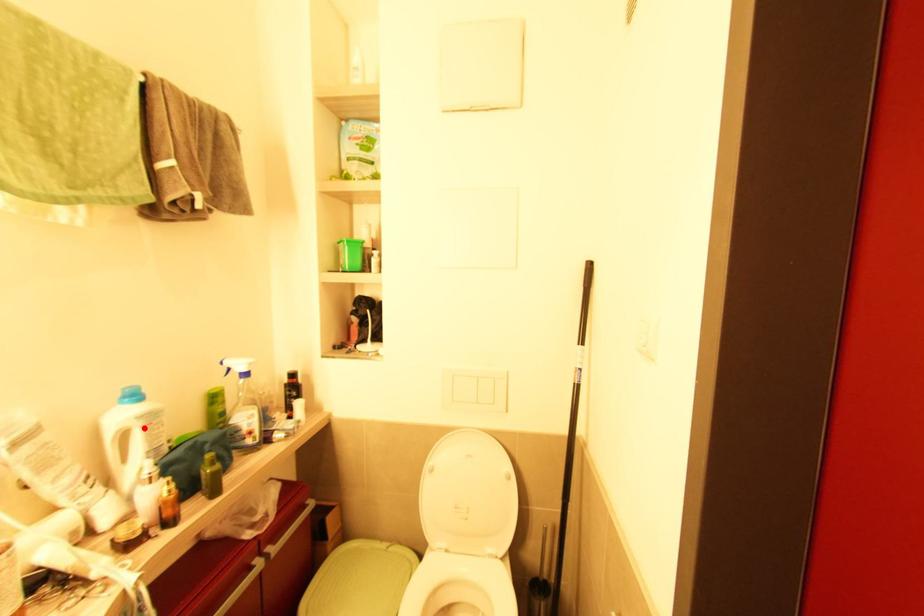
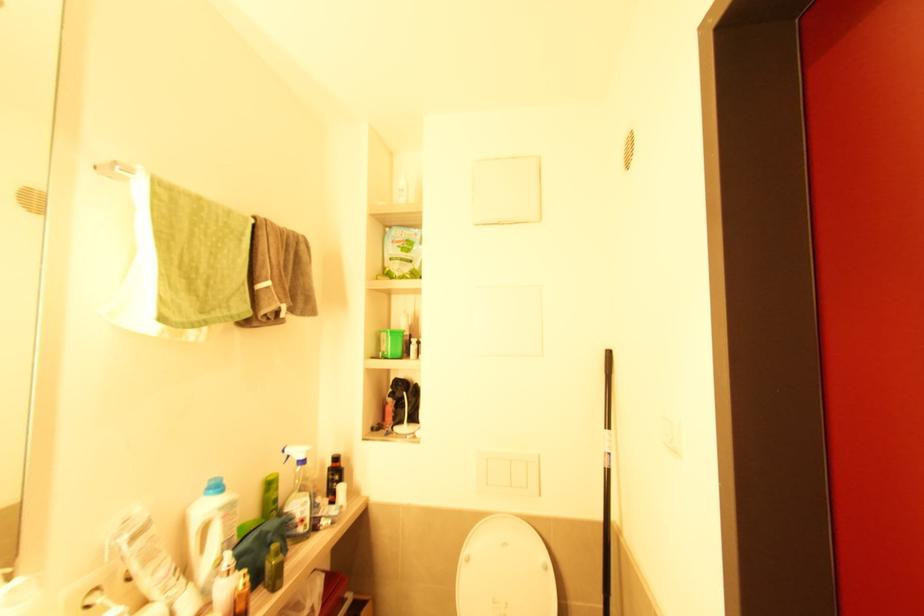
Find the pixel in the second image that matches the highlighted location in the first image.

(224, 519)